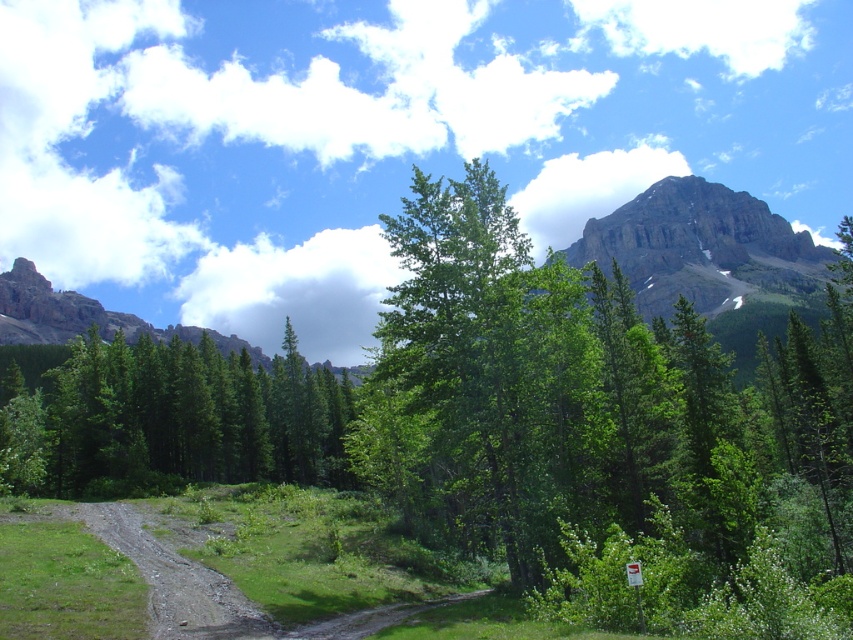
Question: Is green leafy tree at center to the left of rocky gray mountain at upper right from the viewer's perspective?

Choices:
 (A) yes
 (B) no

Answer: (A)

Question: Which point is closer to the camera taking this photo?

Choices:
 (A) pos(199,461)
 (B) pos(851,225)
 (C) pos(10,307)

Answer: (A)

Question: Is green leafy tree at center wider than green matte tree at center?

Choices:
 (A) no
 (B) yes

Answer: (B)

Question: Based on their relative distances, which object is nearer to the rocky gray mountain at upper right?

Choices:
 (A) rugged stone mountain at upper left
 (B) green matte tree at center

Answer: (A)

Question: Can you confirm if green leafy tree at center is wider than rugged stone mountain at upper left?

Choices:
 (A) yes
 (B) no

Answer: (B)

Question: Which point is closer to the camera?

Choices:
 (A) (572, 477)
 (B) (33, 289)
 (C) (322, 483)

Answer: (A)